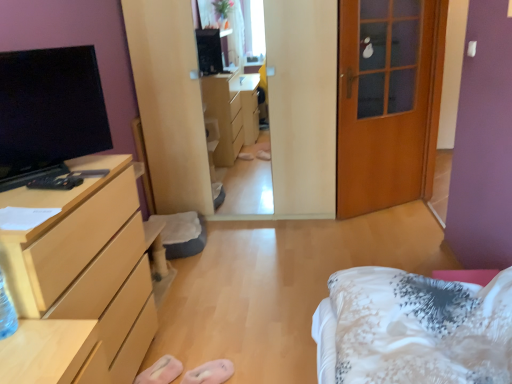
Identify the location of free region under black glossy tv at left (from a real-world perspective). The image size is (512, 384). (74, 161).